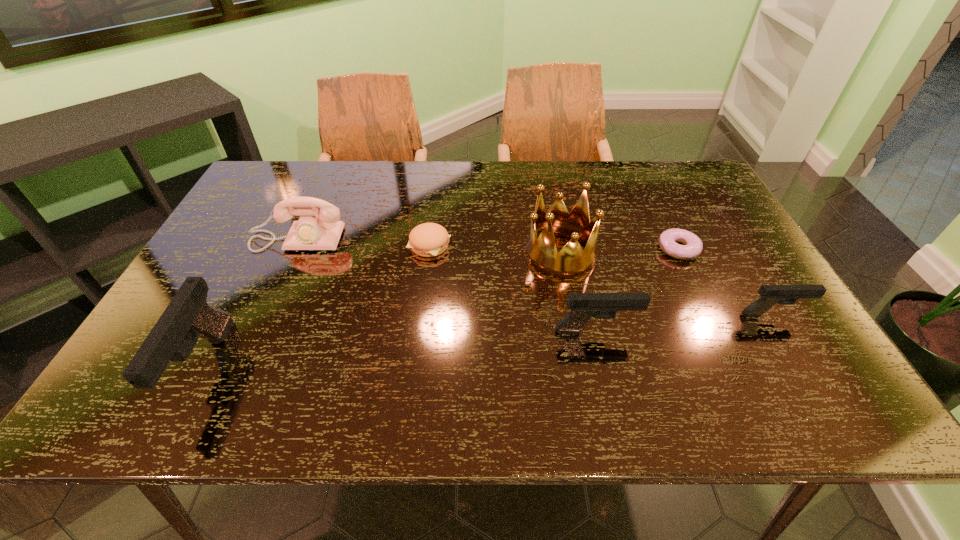
The height and width of the screenshot is (540, 960). What are the coordinates of `free area in between the patty and the shortest pistol` in the screenshot? It's located at [601, 280].

Where is `vacant area that lies between the telephone and the sixth tallest object`? This screenshot has width=960, height=540. vacant area that lies between the telephone and the sixth tallest object is located at coordinates (364, 242).

Identify the location of free area in between the crown and the doughnut. (619, 251).

At what (x,y) coordinates should I click in order to perform the action: click on vacant area between the leftmost pistol and the second shortest pistol. Please return your answer as a coordinate pair (x, y). The image size is (960, 540). Looking at the image, I should click on (400, 349).

At what (x,y) coordinates should I click in order to perform the action: click on free spot between the crown and the second object from right to left. Please return your answer as a coordinate pair (x, y). Image resolution: width=960 pixels, height=540 pixels. Looking at the image, I should click on (619, 251).

Image resolution: width=960 pixels, height=540 pixels. What are the coordinates of `object that is the sixth closest to the crown` in the screenshot? It's located at (188, 316).

Locate which object is the second closest to the farthest pistol. Please provide its 2D coordinates. Your answer should be formatted as a tuple, i.e. [(x, y)], where the tuple contains the x and y coordinates of a point satisfying the conditions above.

[(583, 306)]

Identify which pistol is located as the second nearest to the fourth tallest object. Please provide its 2D coordinates. Your answer should be formatted as a tuple, i.e. [(x, y)], where the tuple contains the x and y coordinates of a point satisfying the conditions above.

[(188, 316)]

Identify which pistol is located as the second nearest to the shortest object. Please provide its 2D coordinates. Your answer should be formatted as a tuple, i.e. [(x, y)], where the tuple contains the x and y coordinates of a point satisfying the conditions above.

[(583, 306)]

Where is `free spot that satisfies the following two spatial constraints: 1. on the front-facing side of the fifth tallest object; 2. on the front-facing side of the tallest pistol`? This screenshot has width=960, height=540. free spot that satisfies the following two spatial constraints: 1. on the front-facing side of the fifth tallest object; 2. on the front-facing side of the tallest pistol is located at coordinates (805, 367).